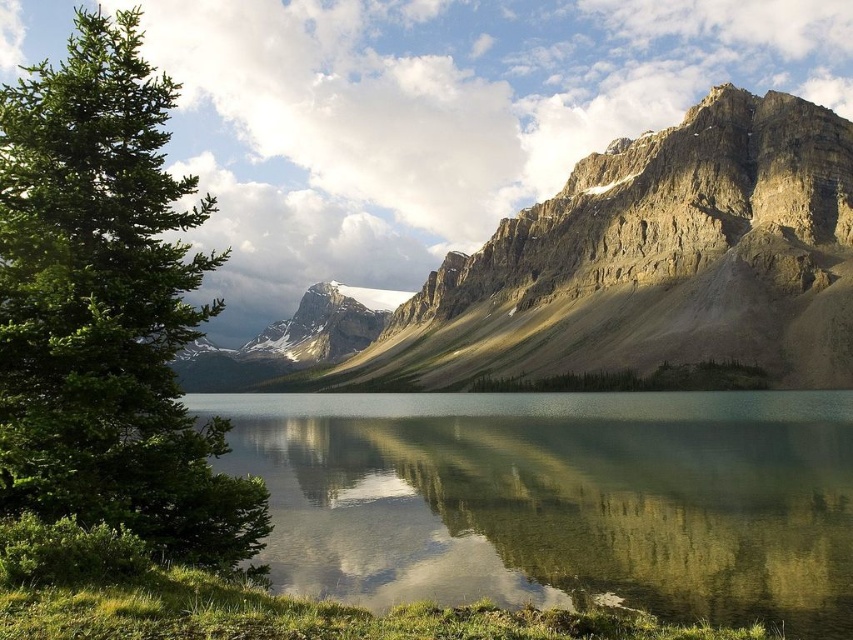
You are standing at the edge of the lake and want to throw a pebble into the clear glass water at center. If you can throw the pebble 80 meters, will it reach the water?

The clear glass water at center is 81.09 meters away from the viewer. Since the pebble can only be thrown 80 meters, it will not reach the water.

You are standing in the scene and want to walk from the green leafy tree at left to the clear glass water at center. Which direction should you move?

You should move to the right towards the clear glass water at center since it is located to the right of the green leafy tree at left.